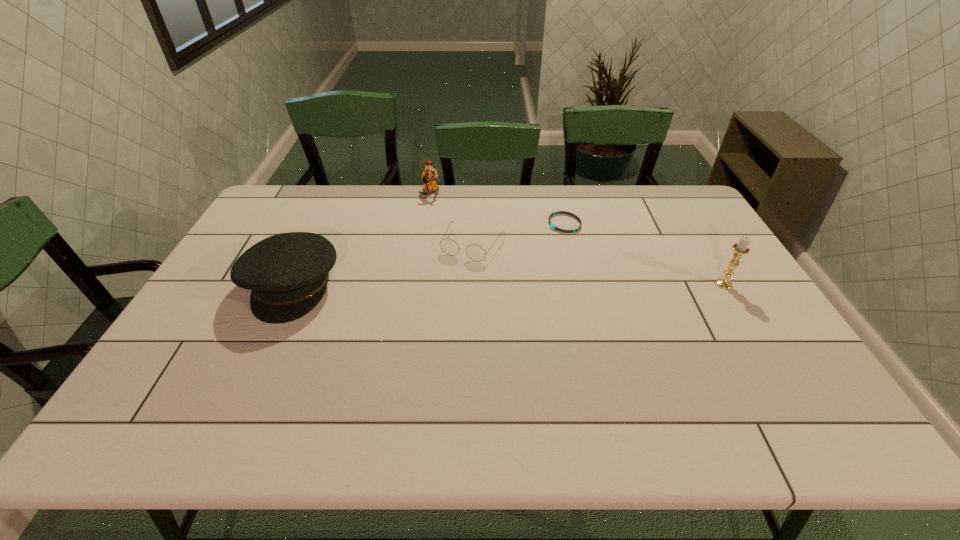
You are a GUI agent. You are given a task and a screenshot of the screen. Output one action in this format:
    pyautogui.click(x=<x>, y=<y>)
    Task: Click on the vacant area that lies between the tallest object and the beret
    Image resolution: width=960 pixels, height=540 pixels.
    Given the screenshot: What is the action you would take?
    pyautogui.click(x=509, y=285)

Identify the location of free space between the leftmost object and the spectacles. (383, 265).

You are a GUI agent. You are given a task and a screenshot of the screen. Output one action in this format:
    pyautogui.click(x=<x>, y=<y>)
    Task: Click on the free space that is in between the second shortest object and the rightmost object
    
    Given the screenshot: What is the action you would take?
    pyautogui.click(x=598, y=264)

Identify the location of empty space between the tallest object and the second shortest object. This screenshot has width=960, height=540. (598, 264).

Find the location of `vacant space that's between the beret and the fourth tallest object`. vacant space that's between the beret and the fourth tallest object is located at coordinates (383, 265).

You are a GUI agent. You are given a task and a screenshot of the screen. Output one action in this format:
    pyautogui.click(x=<x>, y=<y>)
    Task: Click on the unoccupied position between the leftmost object and the farthest object
    The height and width of the screenshot is (540, 960).
    Given the screenshot: What is the action you would take?
    pyautogui.click(x=362, y=240)

Locate an element on the screen. free point between the shortest object and the third object from right to left is located at coordinates (519, 234).

You are a GUI agent. You are given a task and a screenshot of the screen. Output one action in this format:
    pyautogui.click(x=<x>, y=<y>)
    Task: Click on the vacant space that is in between the rightmost object and the wristband
    Image resolution: width=960 pixels, height=540 pixels.
    Given the screenshot: What is the action you would take?
    pyautogui.click(x=644, y=254)

You are a GUI agent. You are given a task and a screenshot of the screen. Output one action in this format:
    pyautogui.click(x=<x>, y=<y>)
    Task: Click on the empty location between the candle holder and the farthest object
    
    Given the screenshot: What is the action you would take?
    pyautogui.click(x=578, y=239)

Find the location of a particular element. The image size is (960, 540). vacant space that is in between the fourth object from right to left and the beret is located at coordinates (362, 240).